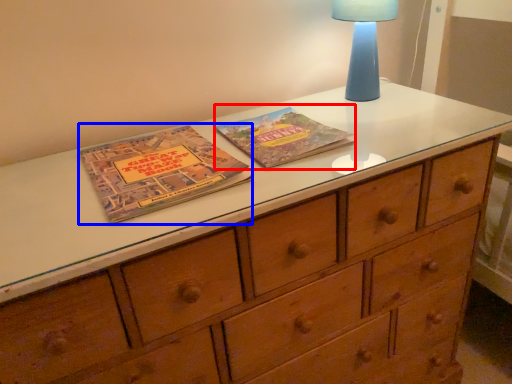
Question: Which of the following is the farthest to the observer, paperback book (highlighted by a red box) or paperback book (highlighted by a blue box)?

Choices:
 (A) paperback book
 (B) paperback book

Answer: (A)